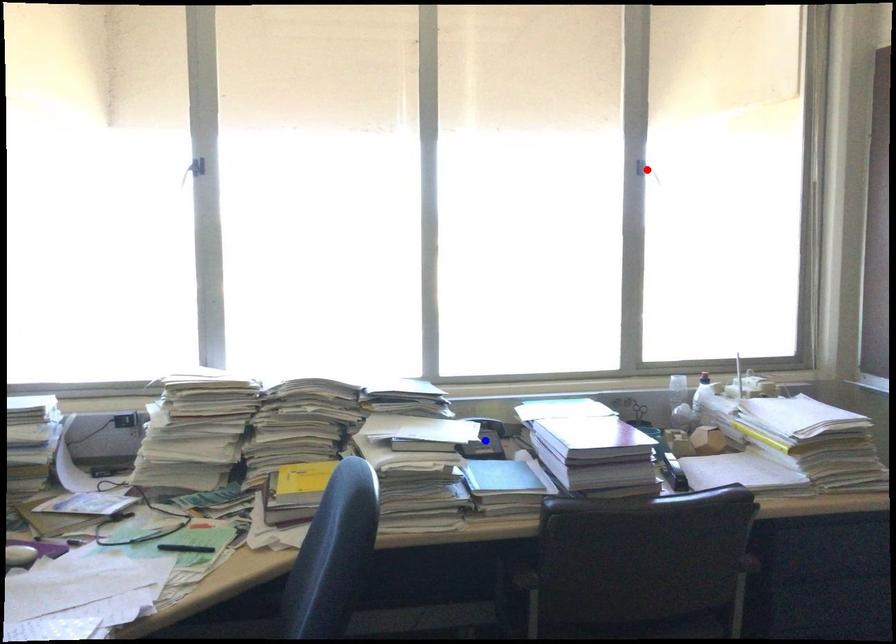
Question: Which of the two points in the image is closer to the camera?

Choices:
 (A) Blue point is closer.
 (B) Red point is closer.

Answer: (A)